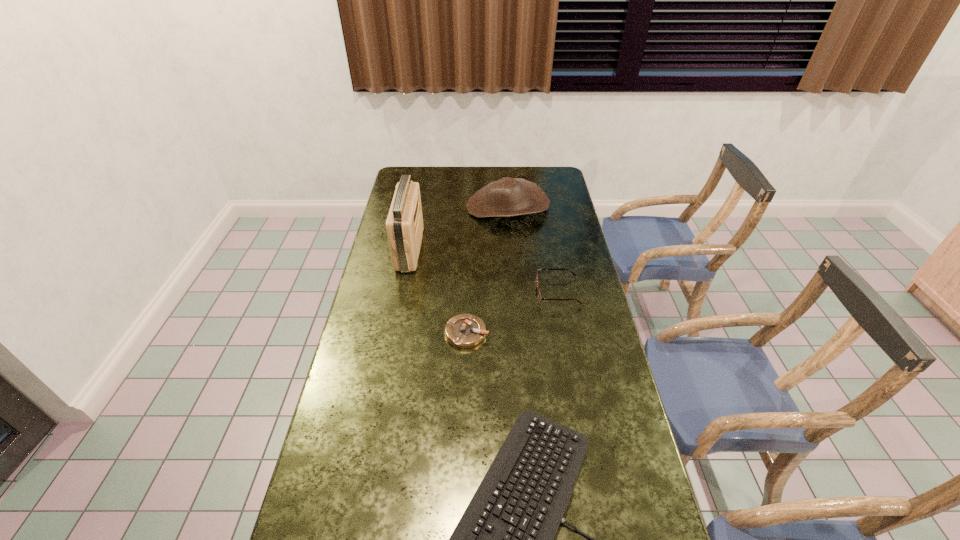
The image size is (960, 540). I want to click on vacant space that satisfies the following two spatial constraints: 1. on the front-facing side of the leftmost object; 2. on the back side of the second nearest object, so click(394, 333).

The image size is (960, 540). Identify the location of free point that satisfies the following two spatial constraints: 1. on the lenses of the third nearest object; 2. on the front side of the second nearest object. (565, 333).